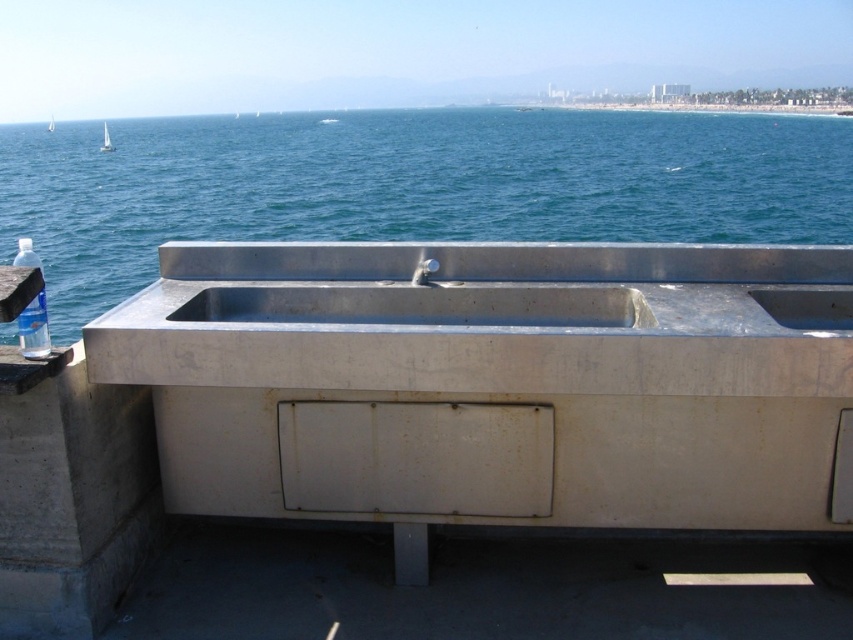
Question: Among these points, which one is farthest from the camera?

Choices:
 (A) pos(51,129)
 (B) pos(415,278)

Answer: (A)

Question: Which object appears closest to the camera in this image?

Choices:
 (A) metallic blue water at center
 (B) clear plastic water at left
 (C) stainless steel sink at center

Answer: (B)

Question: Is gray concrete at lower left to the right of stainless steel sink at center from the viewer's perspective?

Choices:
 (A) yes
 (B) no

Answer: (B)

Question: Is stainless steel sink at center below clear plastic water at left?

Choices:
 (A) yes
 (B) no

Answer: (A)

Question: Which is nearer to the gray concrete at lower left?

Choices:
 (A) white sailboat at left
 (B) clear plastic water at left

Answer: (B)

Question: Considering the relative positions of metallic blue water at center and stainless steel sink at center in the image provided, where is metallic blue water at center located with respect to stainless steel sink at center?

Choices:
 (A) below
 (B) above

Answer: (B)